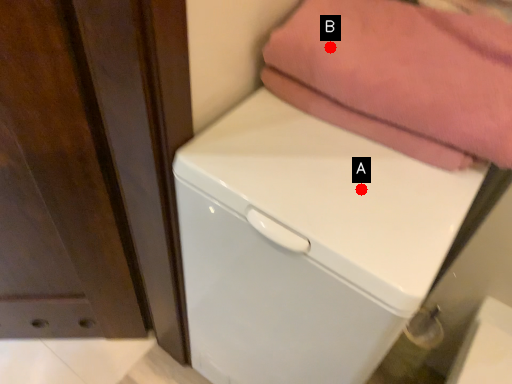
Question: Two points are circled on the image, labeled by A and B beside each circle. Which point appears farthest from the camera in this image?

Choices:
 (A) A is further
 (B) B is further

Answer: (B)